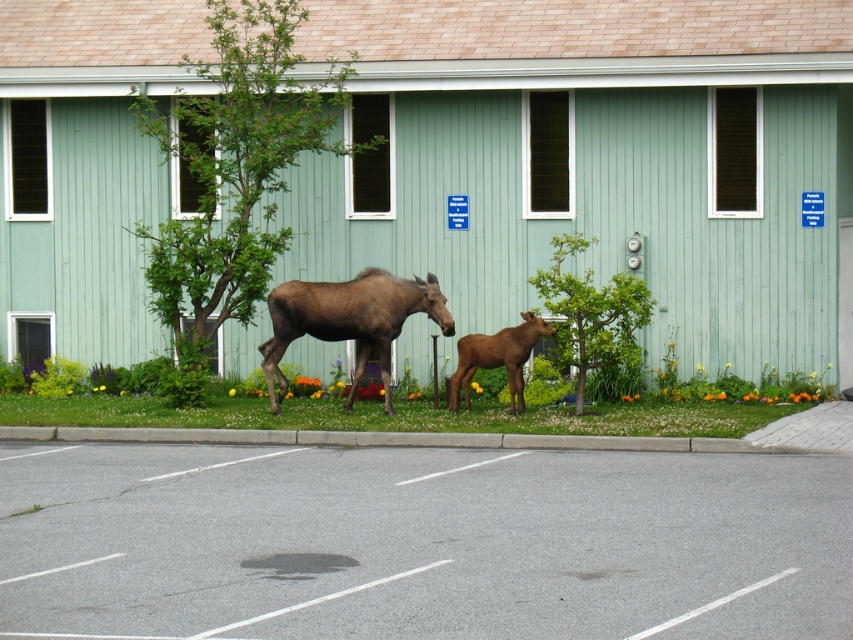
Question: Is green leafy tree at center bigger than brown furry calf at center?

Choices:
 (A) yes
 (B) no

Answer: (A)

Question: Which point is closer to the camera taking this photo?

Choices:
 (A) (578, 349)
 (B) (502, 356)
 (C) (680, 500)

Answer: (C)

Question: Which point is farther from the camera taking this photo?

Choices:
 (A) (466, 344)
 (B) (221, 131)

Answer: (B)

Question: Among these objects, which one is farthest from the camera?

Choices:
 (A) green leafy tree at upper left
 (B) brown matte moose at center
 (C) green leafy tree at center
 (D) gray asphalt parking lot at lower center

Answer: (A)

Question: Is green leafy tree at center below brown furry calf at center?

Choices:
 (A) no
 (B) yes

Answer: (A)

Question: Can you confirm if green leafy tree at center is positioned to the right of brown furry calf at center?

Choices:
 (A) no
 (B) yes

Answer: (B)